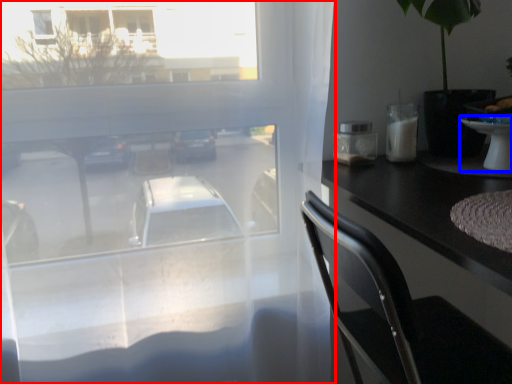
Question: Which of the following is the farthest to the observer, window (highlighted by a red box) or table (highlighted by a blue box)?

Choices:
 (A) window
 (B) table

Answer: (B)